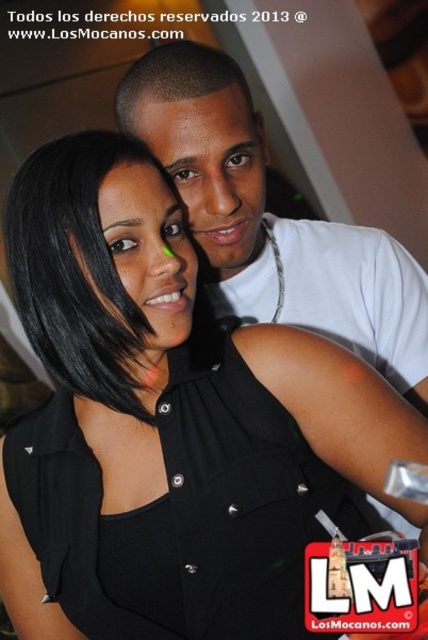
From the picture: You are a photographer who wants to capture a group photo of two people. The two people are currently standing at point (92,596). If you want them to be 1 meter apart in the photo, should they move closer or farther away from each other?

The two people are currently 75.07 centimeters apart. To reach 1 meter, they need to move farther away from each other by approximately 24.93 centimeters.